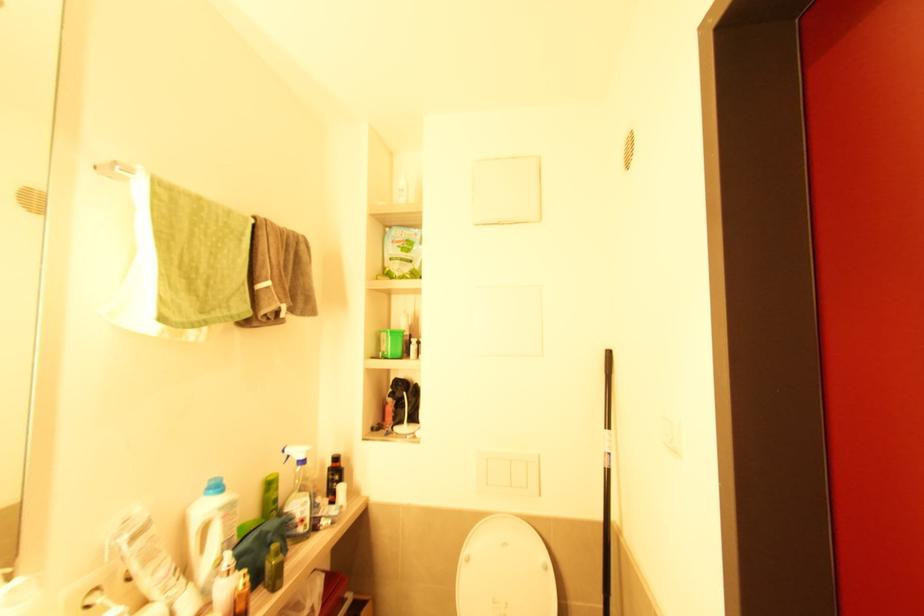
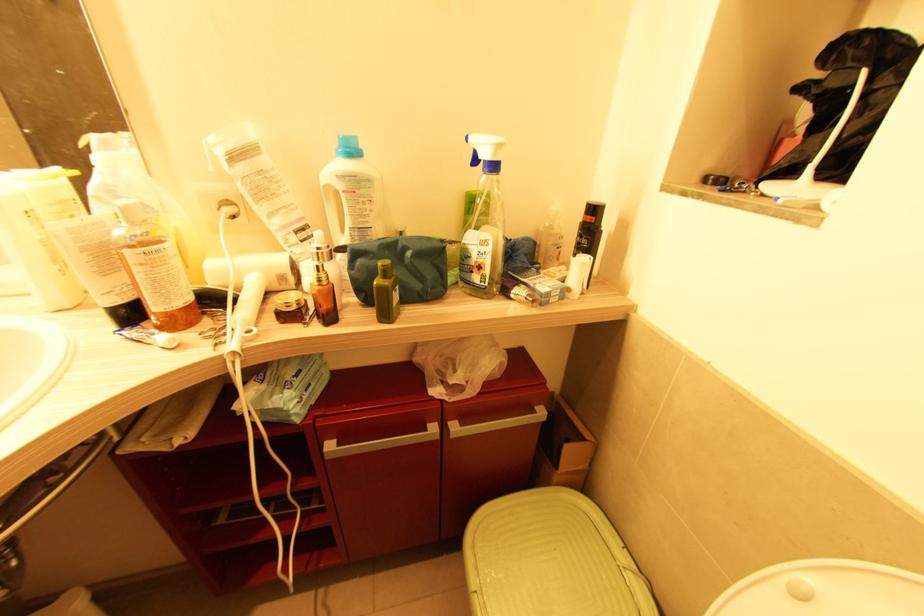
The point at [204,523] is marked in the first image. Where is the corresponding point in the second image?

(329, 188)